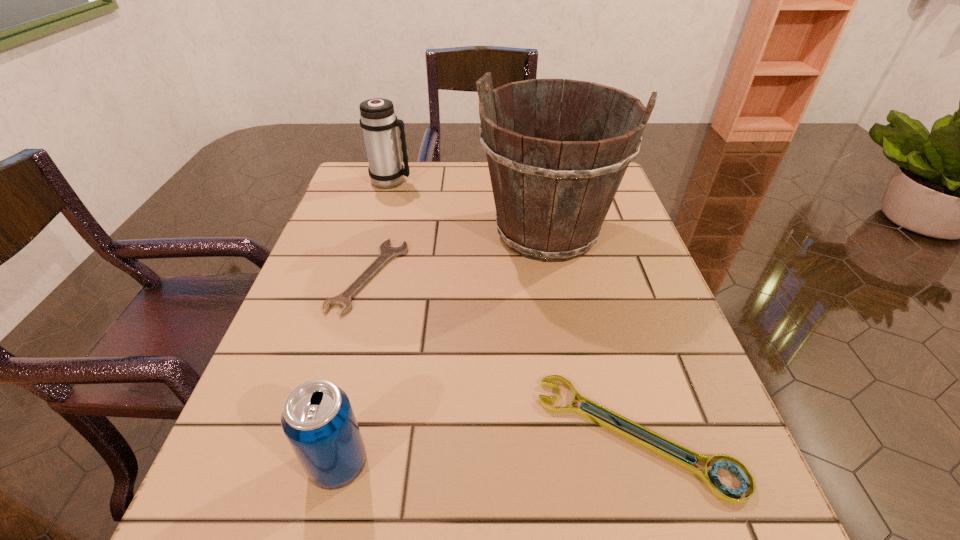
This screenshot has width=960, height=540. I want to click on the tallest object, so click(552, 195).

What are the coordinates of `the second tallest object` in the screenshot? It's located at (378, 120).

Identify the location of the farthest object. (378, 120).

Identify the location of pop soda. (317, 418).

You are a GUI agent. You are given a task and a screenshot of the screen. Output one action in this format:
    pyautogui.click(x=<x>, y=<y>)
    Task: Click on the right wrench
    Image resolution: width=960 pixels, height=540 pixels.
    Given the screenshot: What is the action you would take?
    pyautogui.click(x=719, y=490)

You are a GUI agent. You are given a task and a screenshot of the screen. Output one action in this format:
    pyautogui.click(x=<x>, y=<y>)
    Task: Click on the farther wrench
    The height and width of the screenshot is (540, 960).
    Given the screenshot: What is the action you would take?
    pyautogui.click(x=343, y=300)

This screenshot has width=960, height=540. In order to click on vacant space located 0.110m on the back of the tallest object in this screenshot , I will do `click(537, 175)`.

Locate an element on the screen. vacant space positioned on the side with the handle of the thermos bottle is located at coordinates tap(433, 181).

Image resolution: width=960 pixels, height=540 pixels. I want to click on vacant area situated 0.140m on the back of the pop soda, so click(x=364, y=360).

Identify the location of vacant region located on the left of the nearer wrench. pos(368,435).